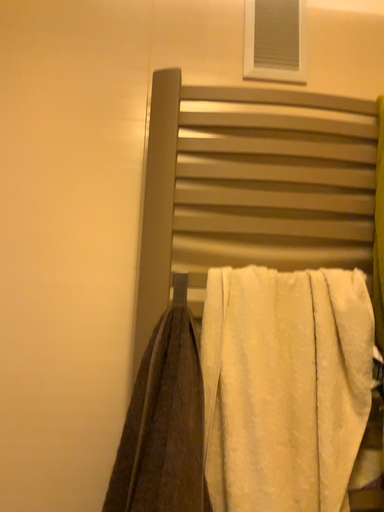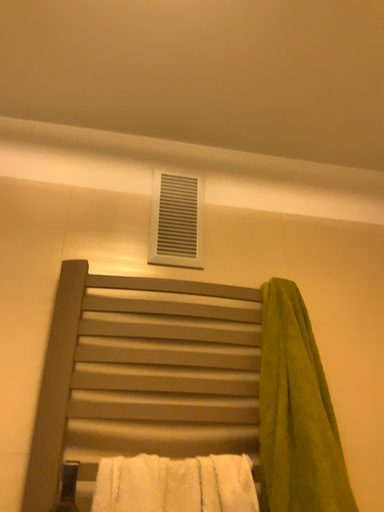
Question: How did the camera likely rotate when shooting the video?

Choices:
 (A) rotated right
 (B) rotated left

Answer: (A)